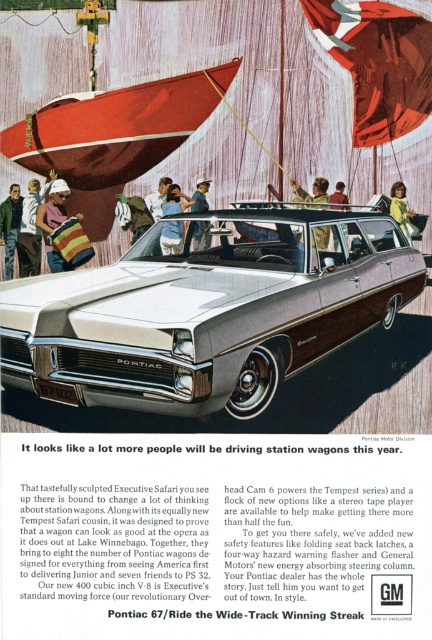
Question: Is green fabric jacket at upper center above brown leather jacket at center?

Choices:
 (A) yes
 (B) no

Answer: (B)

Question: Which point appears farthest from the camera in this image?

Choices:
 (A) (327, 240)
 (B) (403, 225)

Answer: (B)

Question: In this image, where is green fabric jacket at lower left located relative to green fabric jacket at upper center?

Choices:
 (A) left
 (B) right

Answer: (A)

Question: Which point appears closest to the camera in this image?

Choices:
 (A) (346, 200)
 (B) (139, 227)
 (C) (413, 19)

Answer: (C)

Question: Does shiny red boat at center have a smaller size compared to leather jacket at center?

Choices:
 (A) no
 (B) yes

Answer: (A)

Question: Which is nearer to the striped fabric bag at lower left?

Choices:
 (A) green fabric jacket at upper center
 (B) silver metallic station wagon at center

Answer: (B)